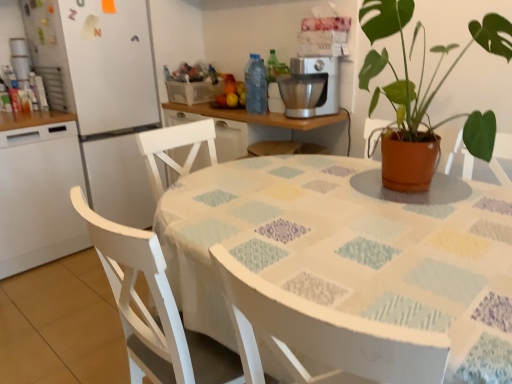
Question: Is white wood chair at lower left in front of or behind terracotta pot at upper right in the image?

Choices:
 (A) behind
 (B) front

Answer: (B)

Question: Which is correct: white wood chair at lower left is inside terracotta pot at upper right, or outside of it?

Choices:
 (A) outside
 (B) inside

Answer: (A)

Question: Which is farther from the transparent plastic bottle at center?

Choices:
 (A) white wood chair at lower left
 (B) satin silver mixer at upper center
 (C) white glossy refrigerator at left
 (D) terracotta pot at upper right
 (E) white matte refrigerator at left

Answer: (A)

Question: Estimate the real-world distances between objects in this image. Which object is farther from the transparent plastic bottle at center?

Choices:
 (A) satin silver mixer at upper center
 (B) white glossy refrigerator at left
 (C) white matte refrigerator at left
 (D) white painted wood table at center
 (E) white wood chair at lower left

Answer: (E)